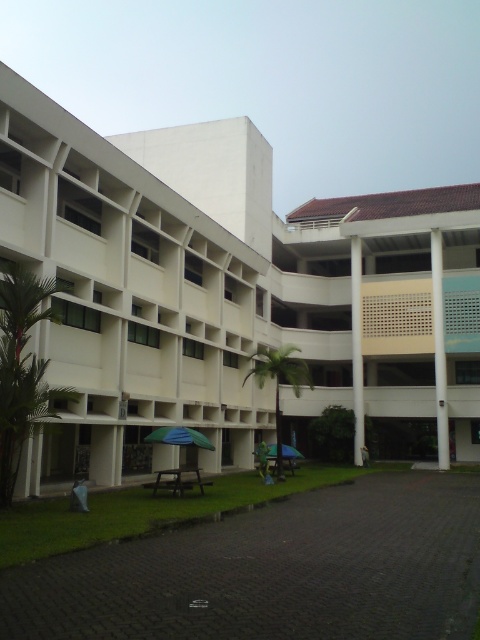
You are planning to set up a temporary tent that requires a 3x3 meter space. You see the white smooth building at center and the green fabric umbrella at lower center. Which object can you use as a reference to determine if the space is large enough?

The white smooth building at center is wider than the green fabric umbrella at lower center. Since the building is larger in width, you can use its dimensions to estimate that the space is likely sufficient for the 3x3 meter tent.

You are standing at the point marked as point (230, 294). What can you see directly in front of you?

You can see the white smooth building at center directly in front of you at point (230, 294).

You are standing at the entrance of the building and want to reach the point marked as point (180, 440). There is an obstacle located at point (35, 122). Will you need to go around the obstacle to reach your destination?

Since point (35, 122) is in front of point (180, 440), the obstacle at point (35, 122) is directly on the path to the destination. Therefore, you will need to go around the obstacle to reach point (180, 440).